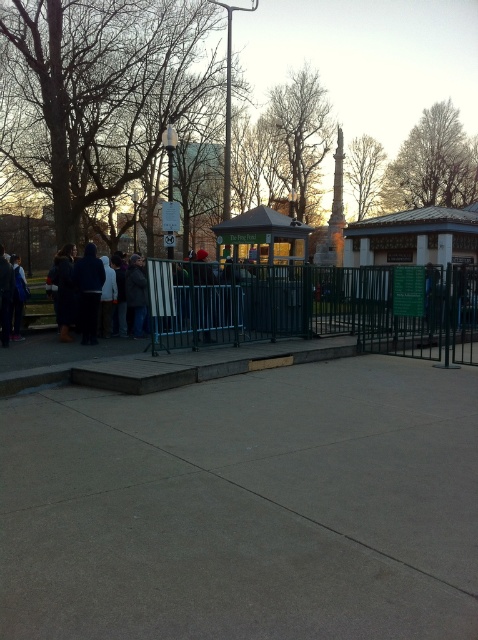
Question: Does green metal fence at center come in front of dark blue jacket at left?

Choices:
 (A) no
 (B) yes

Answer: (B)

Question: Observing the image, what is the correct spatial positioning of dark blue jacket at center in reference to dark blue jacket at left?

Choices:
 (A) right
 (B) left

Answer: (A)

Question: Which object is the farthest from the green metal fence at center?

Choices:
 (A) gray concrete sidewalk at center
 (B) dark blue jacket at center

Answer: (B)

Question: Does gray concrete sidewalk at center have a smaller size compared to dark blue jacket at left?

Choices:
 (A) no
 (B) yes

Answer: (A)

Question: Which is nearer to the dark blue jacket at left?

Choices:
 (A) dark blue jacket at center
 (B) gray concrete sidewalk at center

Answer: (A)

Question: Which point appears farthest from the camera in this image?

Choices:
 (A) (327, 314)
 (B) (415, 451)

Answer: (A)